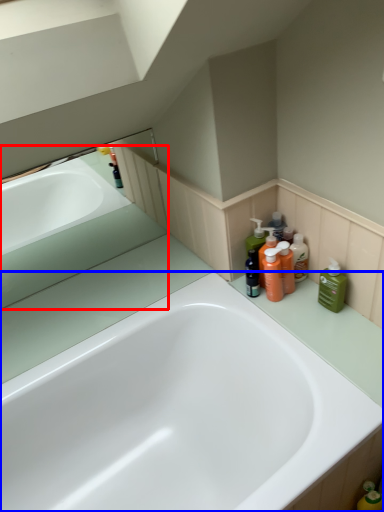
Question: Which point is closer to the camera, bath (highlighted by a red box) or bathtub (highlighted by a blue box)?

Choices:
 (A) bath
 (B) bathtub

Answer: (B)